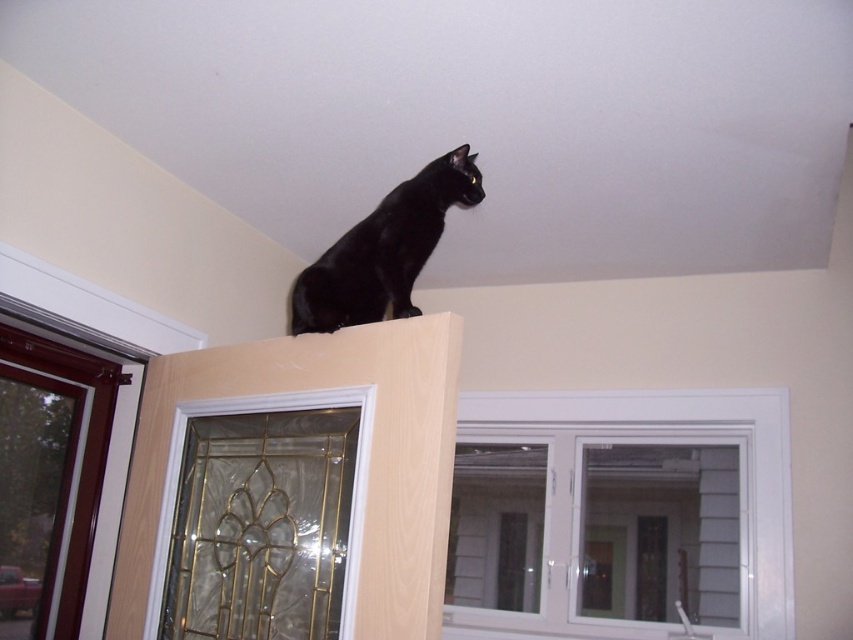
You are holding a 1.5 meter long ladder and want to reach the white plastic window at upper center. Can you reach it with the ladder you have?

The white plastic window at upper center is 2.04 meters away from the camera. Since the ladder is only 1.5 meters long, it is not long enough to reach the window.

You are a painter who needs to clean the white plastic window at upper center and the matte black cat at upper center. Which object requires you to reach higher?

The white plastic window at upper center requires reaching higher because it has a greater height compared to the matte black cat at upper center.

You are a delivery person trying to see inside the room through the white plastic window at upper center and the clear glass door at upper center. Which one allows you to see the room more clearly?

The clear glass door at upper center allows you to see the room more clearly because it is transparent, while the white plastic window at upper center may have a frosted or opaque appearance that reduces clarity.